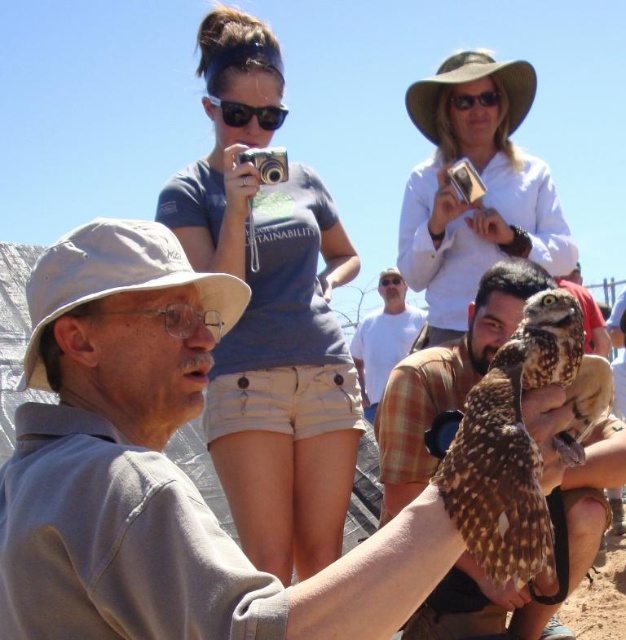
Question: Estimate the real-world distances between objects in this image. Which object is farther from the white cotton shirt at center?

Choices:
 (A) black plastic goggles at upper center
 (B) brown speckled owl at center

Answer: (B)

Question: Which of the following is the farthest from the observer?

Choices:
 (A) click(x=223, y=220)
 (B) click(x=531, y=250)
 (C) click(x=493, y=102)
 (D) click(x=359, y=344)

Answer: (D)

Question: Is blue cotton shirt at upper center closer to the viewer compared to brown speckled owl at center?

Choices:
 (A) yes
 (B) no

Answer: (B)

Question: Is white cotton shirt at center closer to the viewer compared to black plastic goggles at upper center?

Choices:
 (A) no
 (B) yes

Answer: (A)

Question: Which of the following is the closest to the observer?

Choices:
 (A) white cotton shirt at upper center
 (B) white cotton shirt at center
 (C) blue cotton shirt at upper center

Answer: (C)

Question: Is blue cotton shirt at upper center behind white cotton shirt at center?

Choices:
 (A) yes
 (B) no

Answer: (B)